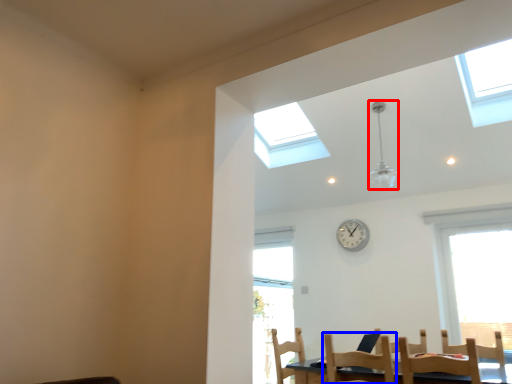
Question: Among these objects, which one is farthest to the camera, light fixture (highlighted by a red box) or chair (highlighted by a blue box)?

Choices:
 (A) light fixture
 (B) chair

Answer: (A)